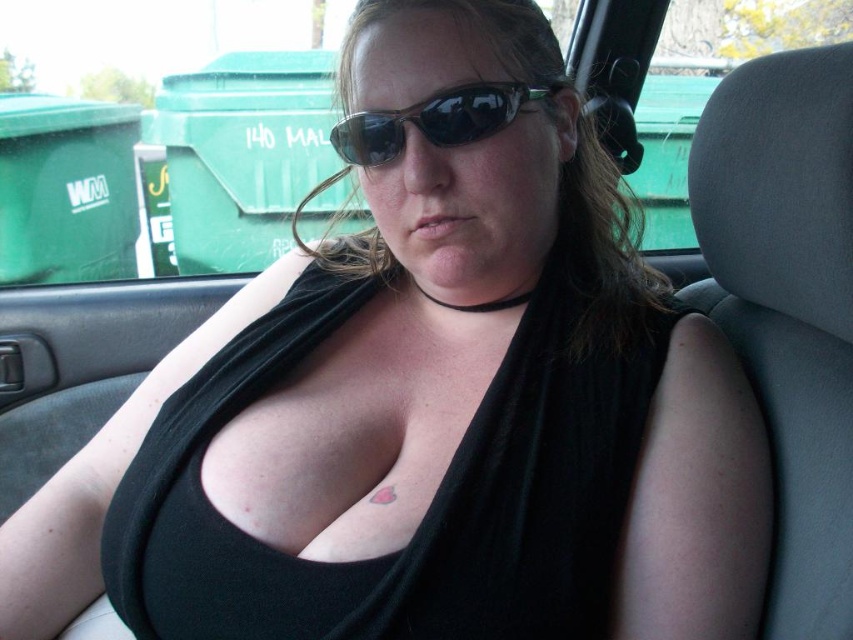
Is black fabric bikini top at center below black plastic sunglasses at center?

Indeed, black fabric bikini top at center is positioned under black plastic sunglasses at center.

Does point (496, 493) lie behind point (525, 83)?

No.

At what (x,y) coordinates should I click in order to perform the action: click on black fabric bikini top at center. Please return your answer as a coordinate pair (x, y). This screenshot has width=853, height=640. Looking at the image, I should click on (431, 500).